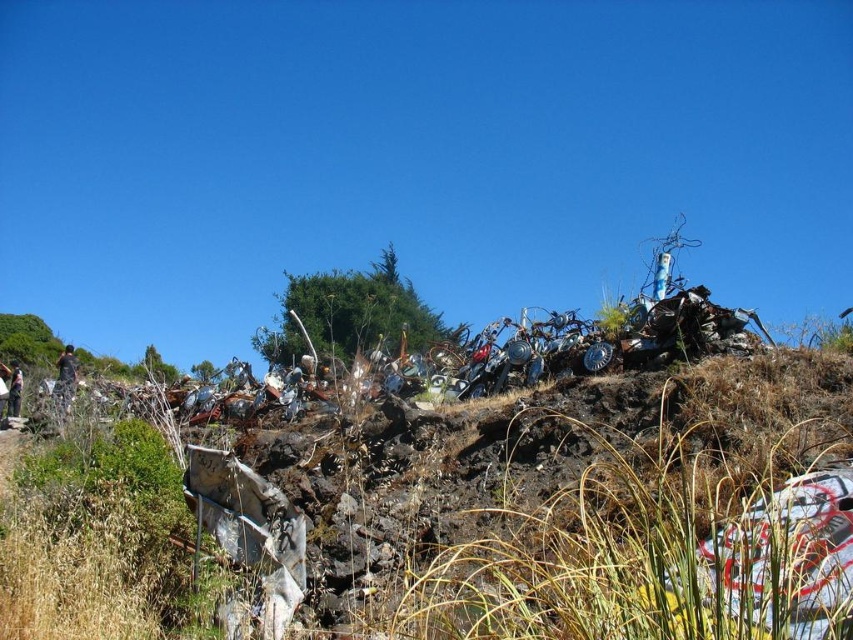
Does camouflage fabric jacket at left appear over camouflage fabric shirt at lower left?

Yes, camouflage fabric jacket at left is above camouflage fabric shirt at lower left.

Which is more to the right, camouflage fabric jacket at left or camouflage fabric shirt at lower left?

Positioned to the right is camouflage fabric jacket at left.

Image resolution: width=853 pixels, height=640 pixels. Describe the element at coordinates (65, 378) in the screenshot. I see `camouflage fabric jacket at left` at that location.

This screenshot has width=853, height=640. What are the coordinates of `camouflage fabric jacket at left` in the screenshot? It's located at (65, 378).

You are a GUI agent. You are given a task and a screenshot of the screen. Output one action in this format:
    pyautogui.click(x=<x>, y=<y>)
    Task: Click on the brown dry grass at lower left
    This screenshot has height=640, width=853.
    Given the screenshot: What is the action you would take?
    pyautogui.click(x=554, y=497)

Can you confirm if brown dry grass at lower left is smaller than camouflage fabric jacket at left?

Incorrect, brown dry grass at lower left is not smaller in size than camouflage fabric jacket at left.

Is brown dry grass at lower left wider than camouflage fabric jacket at left?

Correct, the width of brown dry grass at lower left exceeds that of camouflage fabric jacket at left.

Does point (463, 516) lie behind point (64, 380)?

No.

The height and width of the screenshot is (640, 853). Identify the location of brown dry grass at lower left. (554, 497).